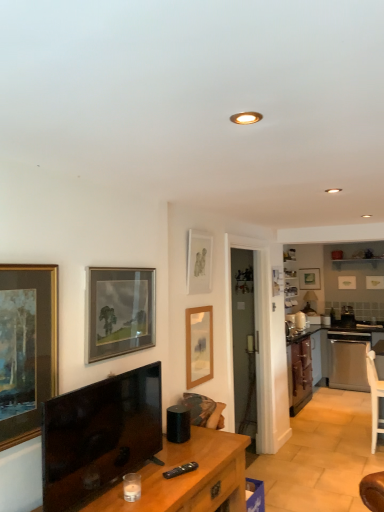
The height and width of the screenshot is (512, 384). I want to click on free spot to the right of black matte speaker at center, which is the 2th appliance in right-to-left order, so click(x=212, y=441).